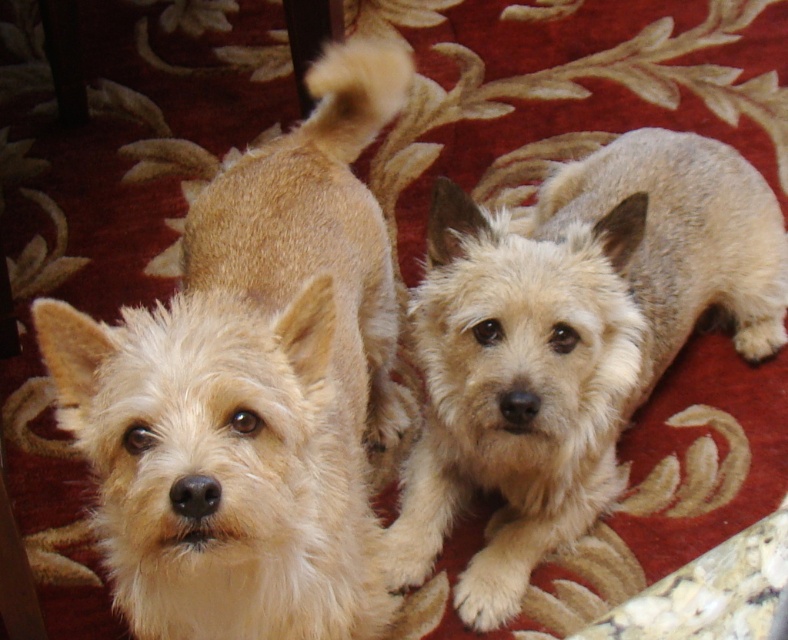
You are a photographer trying to capture both the light beige fur at center and the fuzzy beige dog at center in a single frame. Based on their positions, which one should you adjust your camera angle to focus on first to ensure both are in the frame?

The light beige fur at center is to the left of fuzzy beige dog at center, so you should adjust your camera angle to focus on the light beige fur at center first to ensure both are included in the frame.

You are a photographer trying to capture a closeup of the light beige fur at center and the fuzzy beige dog at center. Which one should you focus on first to ensure it appears sharp in the photo?

The light beige fur at center should be focused on first because it is closer to the viewer than the fuzzy beige dog at center, so focusing on it first ensures it will be sharp.